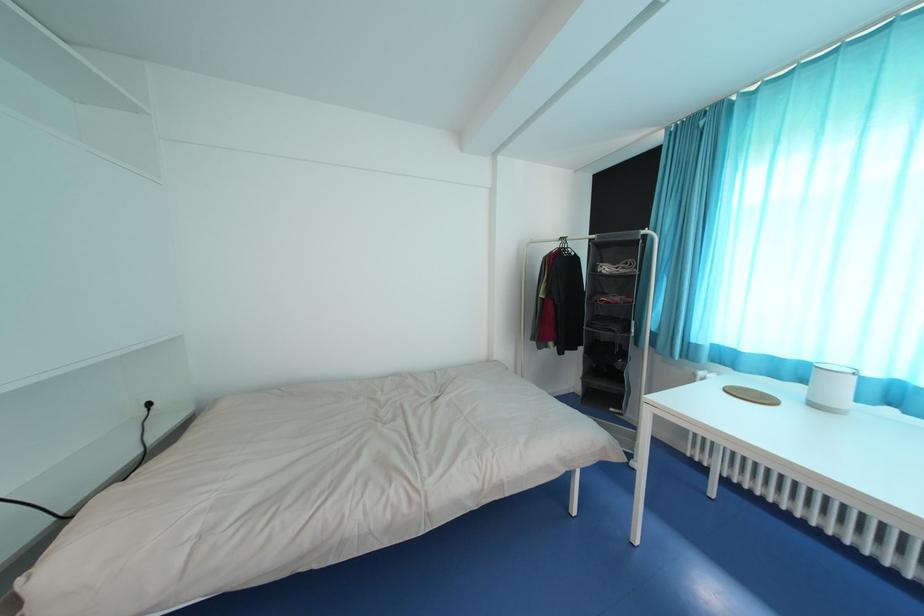
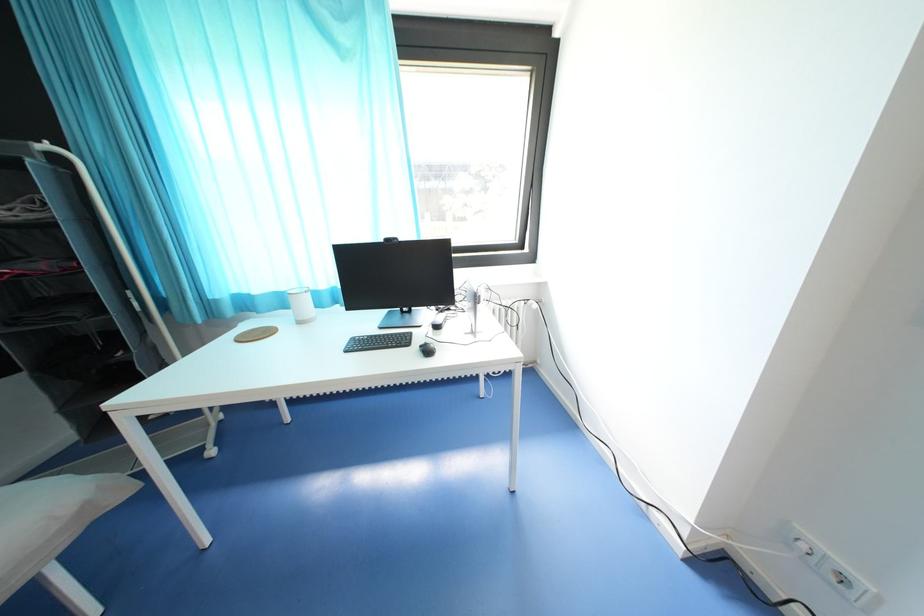
Based on the continuous images, in which direction is the camera rotating?

The rotation direction of the camera is right-down.